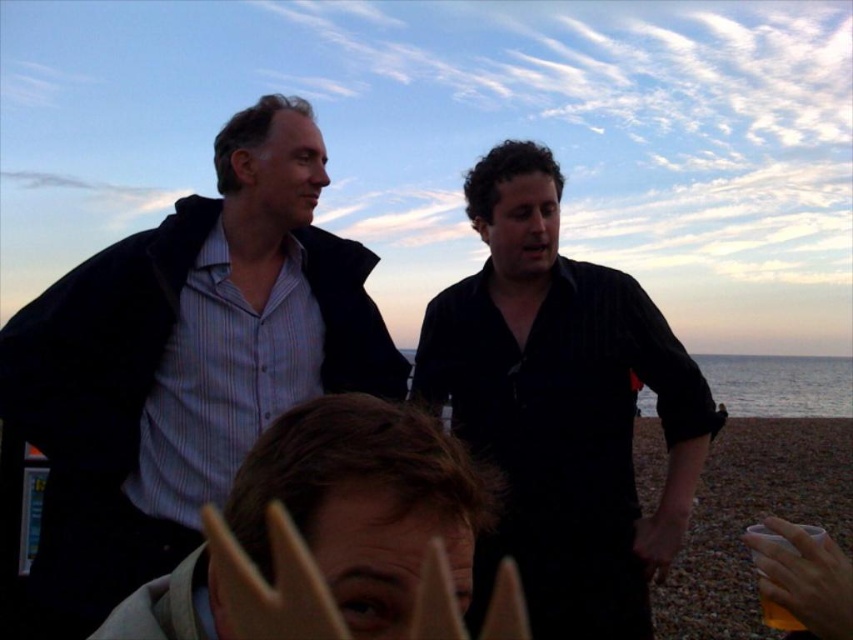
You are standing at point (589, 515) and want to walk towards point (78, 323). According to the scene, will you be moving towards the foreground or background?

Since point (78, 323) is in front of point (589, 515), moving from (589, 515) to (78, 323) means you are moving towards the foreground.

You are a photographer positioned at the edge of the beach, aiming to capture a closeup shot of both the black matte shirt at center and the brown hair at center. Given that your camera has a minimum focusing distance of 5 feet, will you be able to achieve this shot without moving closer?

The black matte shirt at center is 5.30 feet away from brown hair at center. Since the minimum focusing distance is 5 feet, the photographer can capture both subjects as the distance between them is within the camera range.

Based on the photo, you are a photographer at the beach scene. You need to position a spotlight on the person wearing the black matte shirt at center so it doesn t shine on the person with brown hair at center. Based on their positions, which direction should you aim the spotlight?

The black matte shirt at center is to the right of brown hair at center, so you should aim the spotlight to the right side of the brown hair at center to avoid shining it on the person with brown hair at center.